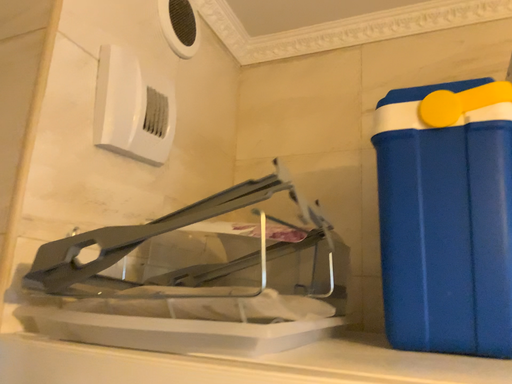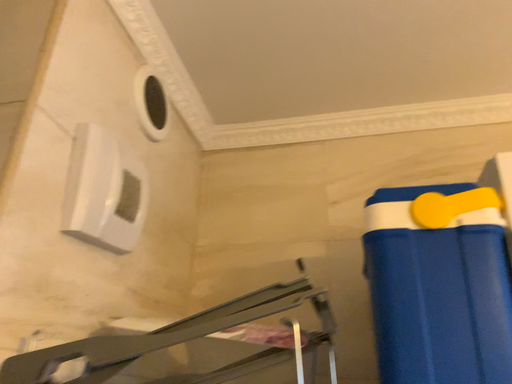
Question: Which way did the camera rotate in the video?

Choices:
 (A) rotated downward
 (B) rotated upward

Answer: (B)